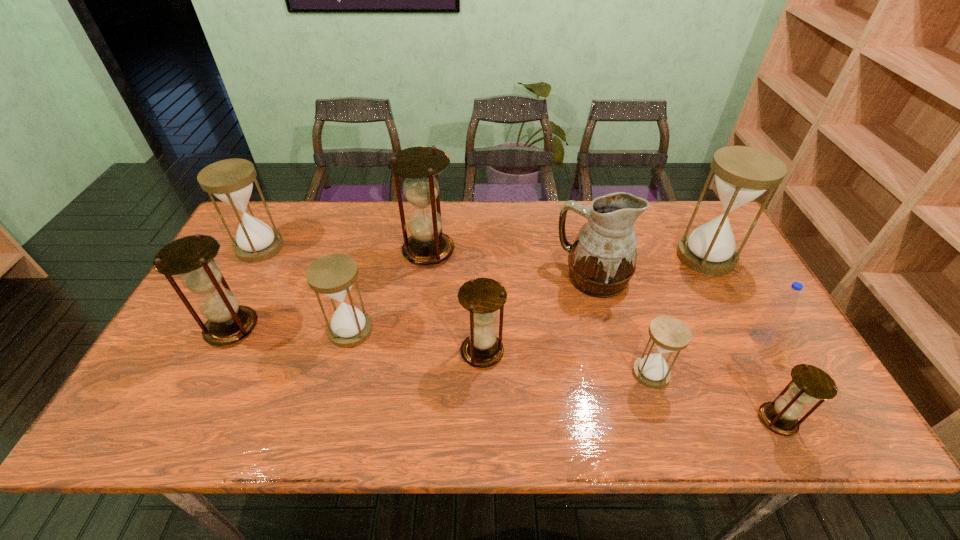
Where is `object located at the far right corner`? Image resolution: width=960 pixels, height=540 pixels. object located at the far right corner is located at coordinates (742, 174).

The height and width of the screenshot is (540, 960). In order to click on object that is at the near right corner in this screenshot , I will do `click(809, 383)`.

I want to click on vacant region at the far edge of the desktop, so click(671, 238).

Find the location of a particular element. free space at the near edge is located at coordinates [x=516, y=419].

At what (x,y) coordinates should I click in order to perform the action: click on blank space at the far left corner. Please return your answer as a coordinate pair (x, y). This screenshot has width=960, height=540. Looking at the image, I should click on (x=285, y=218).

At what (x,y) coordinates should I click in order to perform the action: click on vacant area that lies between the smallest white hourglass and the blue water bottle. Please return your answer as a coordinate pair (x, y). The width and height of the screenshot is (960, 540). Looking at the image, I should click on (706, 355).

In order to click on vacant region between the fifth hourglass from right to left and the third object from left to right in this screenshot , I will do tap(390, 291).

The height and width of the screenshot is (540, 960). I want to click on free point between the biggest white hourglass and the third white hourglass from left to right, so click(x=678, y=315).

Locate an element on the screen. This screenshot has width=960, height=540. vacant space in between the third farthest white hourglass and the third biggest brown hourglass is located at coordinates (417, 341).

This screenshot has height=540, width=960. In order to click on free space between the rightmost white hourglass and the nearest white hourglass in this screenshot , I will do `click(678, 315)`.